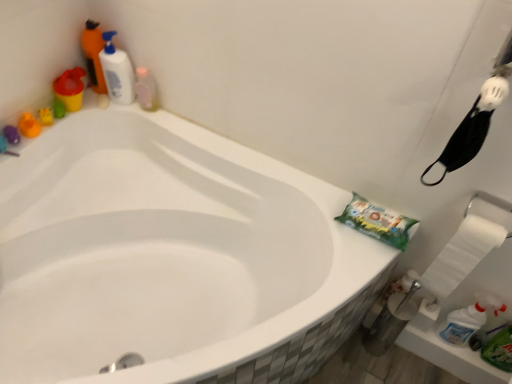
Question: Can you confirm if white paper towel at right is thinner than translucent plastic bottle at upper left, positioned as the 1th cleaning product in right-to-left order?

Choices:
 (A) no
 (B) yes

Answer: (B)

Question: Is white paper towel at right shorter than translucent plastic bottle at upper left, positioned as the 1th cleaning product in right-to-left order?

Choices:
 (A) no
 (B) yes

Answer: (A)

Question: Considering the relative sizes of white paper towel at right and translucent plastic bottle at upper left, positioned as the 1th cleaning product in right-to-left order, in the image provided, is white paper towel at right bigger than translucent plastic bottle at upper left, positioned as the 1th cleaning product in right-to-left order,?

Choices:
 (A) no
 (B) yes

Answer: (B)

Question: Considering the relative positions of white paper towel at right and translucent plastic bottle at upper left, positioned as the 1th cleaning product in right-to-left order, in the image provided, is white paper towel at right to the left of translucent plastic bottle at upper left, positioned as the 1th cleaning product in right-to-left order, from the viewer's perspective?

Choices:
 (A) no
 (B) yes

Answer: (A)

Question: Is white paper towel at right taller than translucent plastic bottle at upper left, acting as the third cleaning product starting from the left?

Choices:
 (A) no
 (B) yes

Answer: (B)

Question: Is white paper towel at right turned away from translucent plastic bottle at upper left, positioned as the 1th cleaning product in right-to-left order?

Choices:
 (A) no
 (B) yes

Answer: (A)

Question: Does translucent plastic bottle at upper left, acting as the third cleaning product starting from the left, lie in front of white glossy bottle at upper left, the second cleaning product positioned from the right?

Choices:
 (A) yes
 (B) no

Answer: (B)

Question: Can you confirm if translucent plastic bottle at upper left, acting as the third cleaning product starting from the left, is positioned to the right of white glossy bottle at upper left, the second cleaning product positioned from the right?

Choices:
 (A) yes
 (B) no

Answer: (A)

Question: Is the position of translucent plastic bottle at upper left, positioned as the 1th cleaning product in right-to-left order, more distant than that of white glossy bottle at upper left, the second cleaning product positioned from the right?

Choices:
 (A) no
 (B) yes

Answer: (B)

Question: Is translucent plastic bottle at upper left, positioned as the 1th cleaning product in right-to-left order, smaller than white glossy bottle at upper left, the second cleaning product positioned from the right?

Choices:
 (A) no
 (B) yes

Answer: (B)

Question: Is translucent plastic bottle at upper left, acting as the third cleaning product starting from the left, far away from white glossy bottle at upper left, the second cleaning product positioned from the right?

Choices:
 (A) yes
 (B) no

Answer: (B)

Question: Would you say translucent plastic bottle at upper left, positioned as the 1th cleaning product in right-to-left order, contains white glossy bottle at upper left, acting as the second cleaning product starting from the left?

Choices:
 (A) yes
 (B) no

Answer: (B)

Question: Is white glossy bottle at upper left, the second cleaning product positioned from the right, positioned beyond the bounds of translucent plastic bottle at upper left, positioned as the 1th cleaning product in right-to-left order?

Choices:
 (A) yes
 (B) no

Answer: (A)